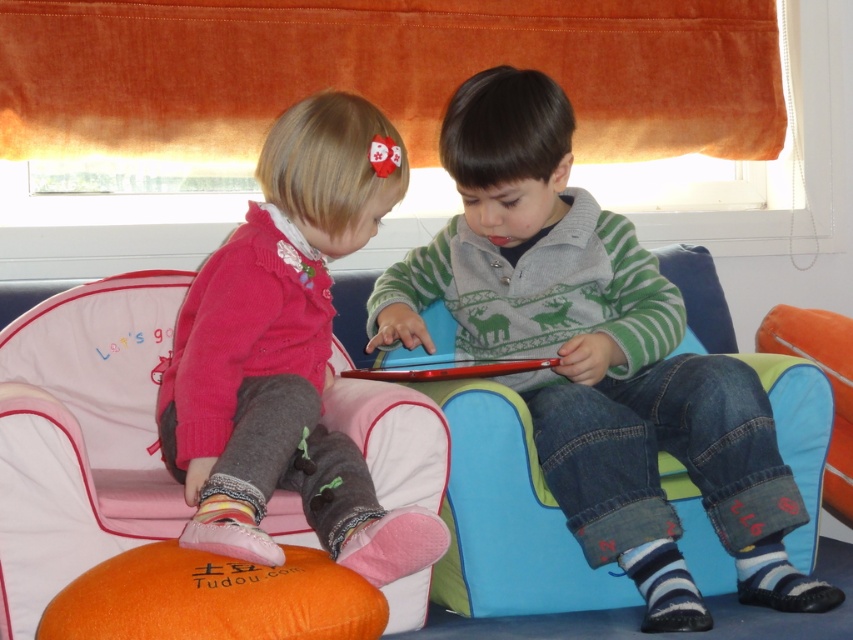
Based on the photo, is matte green sweater at center in front of matte pink sweater at center?

No.

How far apart are matte green sweater at center and matte pink sweater at center?

matte green sweater at center and matte pink sweater at center are 16.31 inches apart from each other.

Between point (770, 484) and point (339, 132), which one is positioned behind?

The point (770, 484) is more distant.

Find the location of `matte green sweater at center`. matte green sweater at center is located at coordinates (596, 356).

What do you see at coordinates (287, 353) in the screenshot?
I see `matte pink sweater at center` at bounding box center [287, 353].

Locate an element on the screen. This screenshot has width=853, height=640. matte pink sweater at center is located at coordinates (287, 353).

Is point (294, 132) farther from viewer compared to point (10, 612)?

Yes, point (294, 132) is farther from viewer.

This screenshot has width=853, height=640. I want to click on matte pink sweater at center, so click(x=287, y=353).

Between matte green sweater at center and orange fabric bean bag at lower left, which one appears on the right side from the viewer's perspective?

From the viewer's perspective, matte green sweater at center appears more on the right side.

Based on the photo, which is more to the left, matte green sweater at center or orange fabric bean bag at lower left?

Positioned to the left is orange fabric bean bag at lower left.

Locate an element on the screen. The height and width of the screenshot is (640, 853). matte green sweater at center is located at coordinates (596, 356).